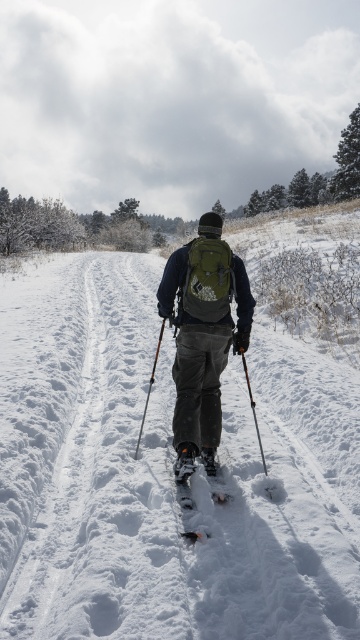
Question: Among these points, which one is farthest from the camera?

Choices:
 (A) (162, 326)
 (B) (198, 346)

Answer: (A)

Question: Does green fabric backpack at center have a lesser width compared to black matte ski at center?

Choices:
 (A) yes
 (B) no

Answer: (B)

Question: Is matte black ski pole at center thinner than white rubber snowshoe at center?

Choices:
 (A) no
 (B) yes

Answer: (A)

Question: Is white fluffy snow at center bigger than white textured snowshoe at center?

Choices:
 (A) no
 (B) yes

Answer: (B)

Question: Which of these objects is positioned closest to the black matte ski at center?

Choices:
 (A) white fluffy snow at center
 (B) white rubber snowshoe at center
 (C) matte black ski pole at center

Answer: (B)

Question: Among these objects, which one is farthest from the camera?

Choices:
 (A) matte black ski pole at center
 (B) green fabric backpack at center

Answer: (A)